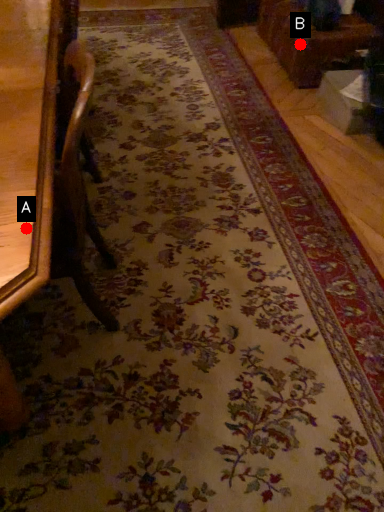
Question: Two points are circled on the image, labeled by A and B beside each circle. Which point is closer to the camera taking this photo?

Choices:
 (A) A is closer
 (B) B is closer

Answer: (A)